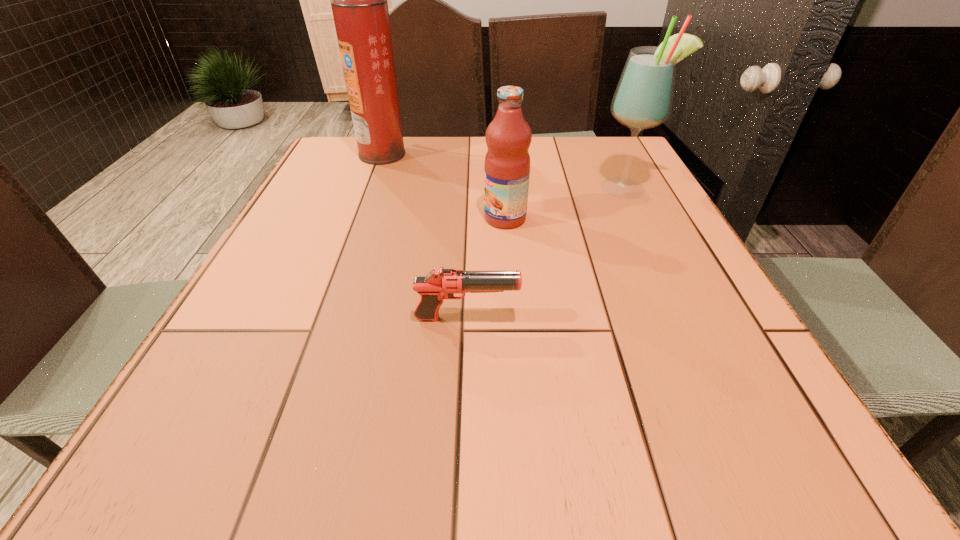
This screenshot has height=540, width=960. In order to click on vacant point located between the leftmost object and the fruit juice in this screenshot , I will do `click(444, 186)`.

Identify the location of object that is the closest to the second farthest object. Image resolution: width=960 pixels, height=540 pixels. (508, 137).

This screenshot has width=960, height=540. What are the coordinates of `object that can be found as the third closest to the nearest object` in the screenshot? It's located at (359, 0).

The height and width of the screenshot is (540, 960). I want to click on blank space that satisfies the following two spatial constraints: 1. on the back side of the third nearest object; 2. at the nozzle of the tallest object, so click(x=609, y=154).

At what (x,y) coordinates should I click in order to perform the action: click on vacant space that satisfies the following two spatial constraints: 1. at the nozzle of the rightmost object; 2. on the left side of the leftmost object. Please return your answer as a coordinate pair (x, y). Looking at the image, I should click on (370, 188).